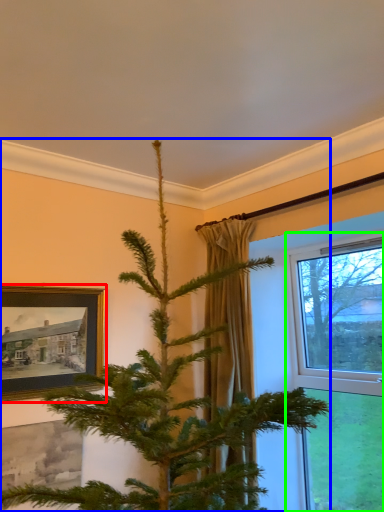
Question: Which object is the closest to the picture frame (highlighted by a red box)? Choose among these: christmas tree (highlighted by a blue box) or window (highlighted by a green box).

Choices:
 (A) christmas tree
 (B) window

Answer: (A)